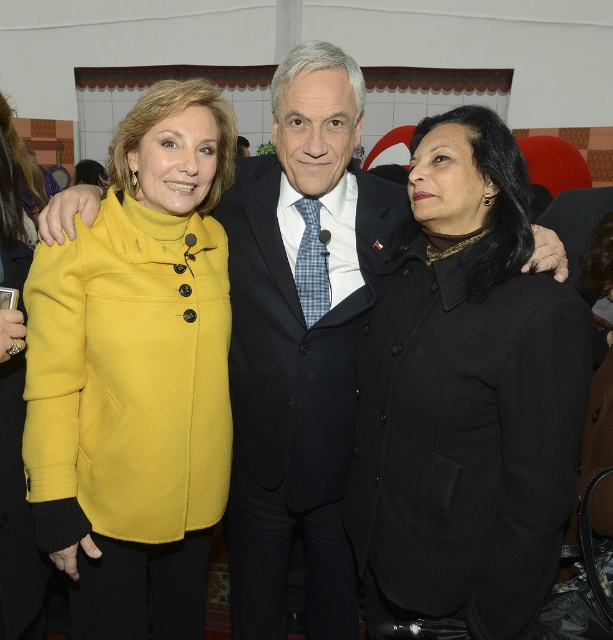
Question: Which object is positioned farthest from the yellow woolen coat at left?

Choices:
 (A) dark blue wool suit at center
 (B) black wool coat at center

Answer: (B)

Question: Which point is farther from the camera taking this photo?

Choices:
 (A) (306, 560)
 (B) (525, 282)

Answer: (A)

Question: Can you confirm if black wool coat at center is positioned below yellow woolen coat at left?

Choices:
 (A) no
 (B) yes

Answer: (A)

Question: Considering the real-world distances, which object is closest to the yellow woolen coat at left?

Choices:
 (A) dark blue wool suit at center
 (B) black wool coat at center

Answer: (A)

Question: Is yellow woolen coat at left bigger than dark blue wool suit at center?

Choices:
 (A) yes
 (B) no

Answer: (B)

Question: Can you confirm if black wool coat at center is thinner than dark blue wool suit at center?

Choices:
 (A) yes
 (B) no

Answer: (A)